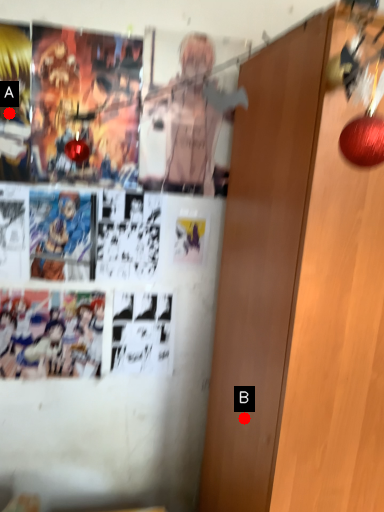
Question: Two points are circled on the image, labeled by A and B beside each circle. Which point appears closest to the camera in this image?

Choices:
 (A) A is closer
 (B) B is closer

Answer: (B)